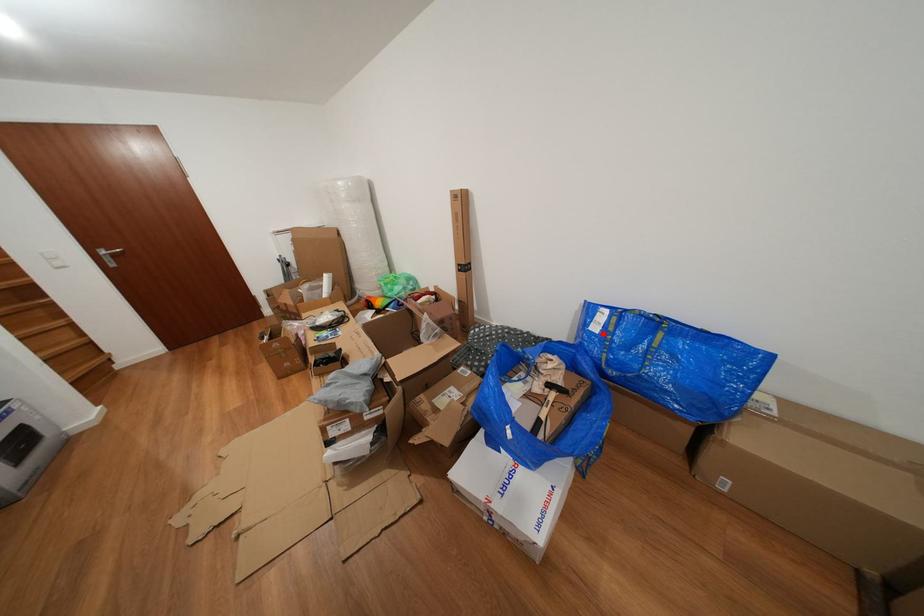
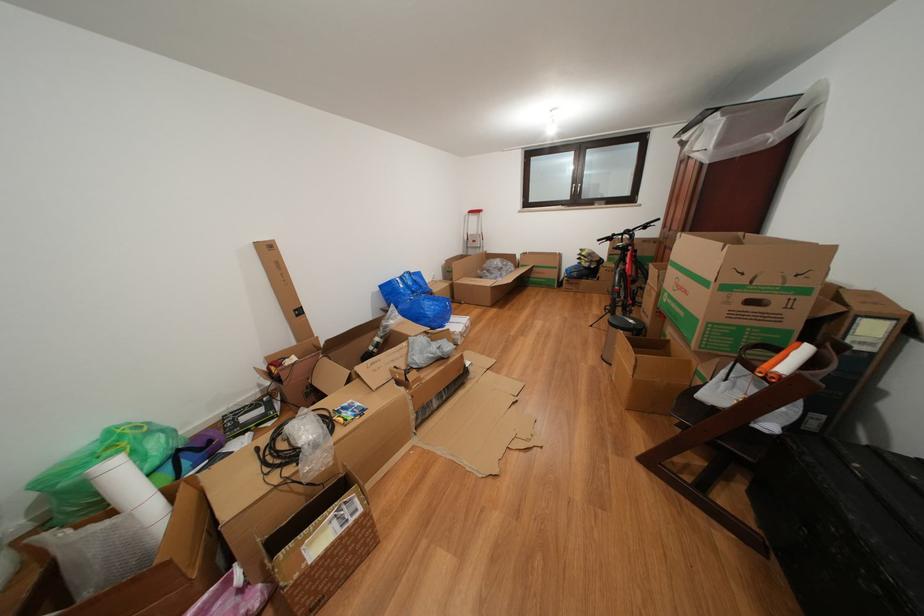
In the second image, find the point that corresponds to the highlighted location in the first image.

(409, 291)